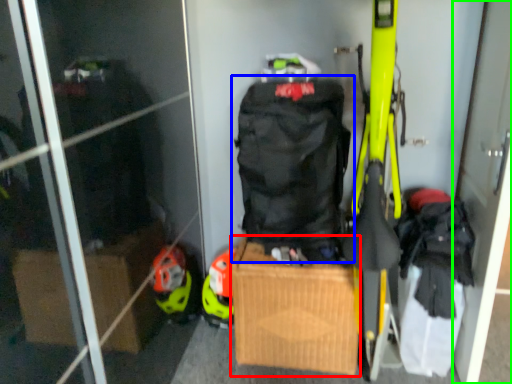
Question: Considering the real-world distances, which object is farthest from cardboard box (highlighted by a red box)? backpack (highlighted by a blue box) or screen door (highlighted by a green box)?

Choices:
 (A) backpack
 (B) screen door

Answer: (B)